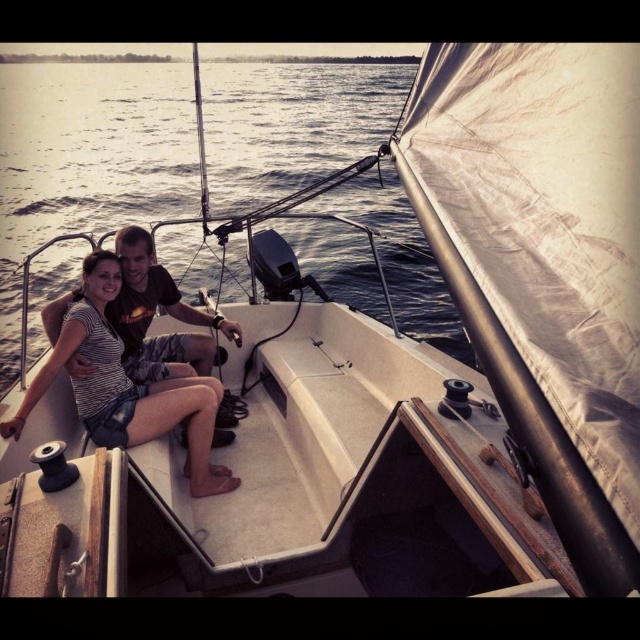
You are navigating a small sailboat and need to place two buoys at specific coordinates to mark safe passage. The coordinates are point (401, 200) and point (195, 497). Which buoy should you place first if you want to follow the path from the front of the boat to the back?

You should place the buoy at point (195, 497) first because point (401, 200) is behind it, so following the path from the front to the back of the boat, you would encounter point (195, 497) first.

You are a photographer trying to capture the striped fabric dress at center and the blue water at center in one shot. Based on their positions, which object is wider in the image?

The blue water at center is wider than the striped fabric dress at center.